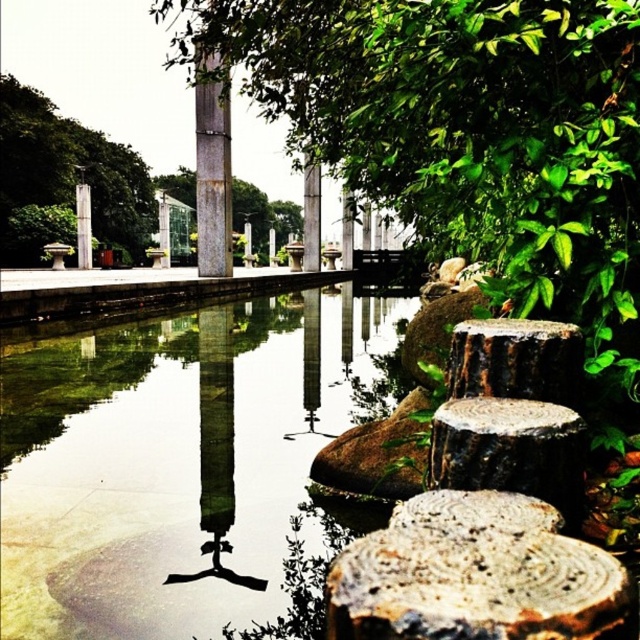
Question: Is sanded concrete pillar at center above white marble pillar at center?

Choices:
 (A) yes
 (B) no

Answer: (B)

Question: Can you confirm if green leafy tree at upper left is thinner than smooth gray pillar at center?

Choices:
 (A) no
 (B) yes

Answer: (A)

Question: Which of the following is the farthest from the observer?

Choices:
 (A) (102, 244)
 (B) (227, 125)
 (C) (264, 252)
 (D) (157, 202)

Answer: (C)

Question: Which of the following is the closest to the observer?

Choices:
 (A) smooth gray pillar at center
 (B) rustic wooden post at center
 (C) rusty metal pole at center
 (D) white marble pillar at center

Answer: (C)

Question: Can you confirm if rustic wooden post at center is smaller than smooth concrete pillar at center?

Choices:
 (A) no
 (B) yes

Answer: (A)

Question: Which point is closer to the camera?

Choices:
 (A) rough bark stump at center
 (B) rusty metal pole at center
 (C) white marble pillar at center

Answer: (A)